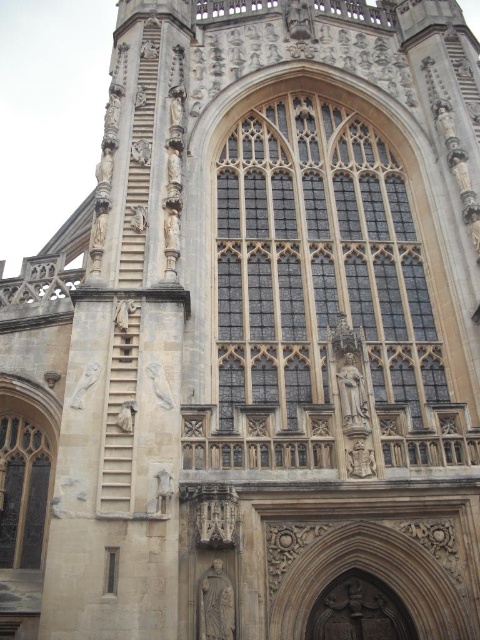
You are an architect designing a new cathedral and want to replicate the style of the Gothic building in the image. You need to place two windows, one similar to the stained glass window at center and another similar to the dark glass window at lower left. Which window should be placed higher up in the design to match the original building?

The stained glass window at center should be placed higher up in the design because it is bigger than the dark glass window at lower left, which is typical in Gothic architecture for larger windows to be positioned higher to allow more light into the upper sections.

Based on the photo, you are a maintenance worker needing to inspect two windows in the cathedral. You have a ladder that can extend to 25 meters. The stained glass window at center and the dark glass window at lower left are both on the same wall. Can you reach both windows with your ladder without moving it?

The distance between the stained glass window at center and the dark glass window at lower left is 25.52 meters. Since your ladder can only extend to 25 meters, you cannot reach both windows without moving the ladder because the distance exceeds the ladder length.

You are an architect inspecting the facade of a Gothic cathedral. You notice two windows, the stained glass window at center and the dark glass window at lower left. Which one has a greater height?

The stained glass window at center is much taller as dark glass window at lower left, so the stained glass window at center has a greater height.